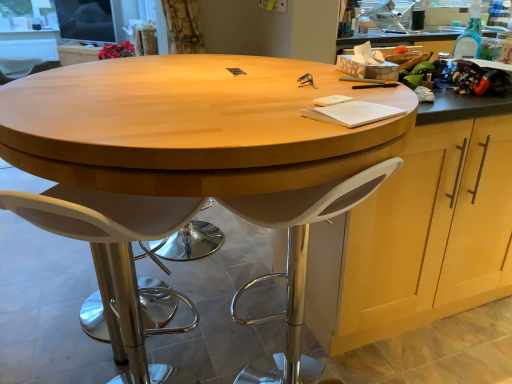
The width and height of the screenshot is (512, 384). Identify the location of light wood cabinet at upper center, which appears as the first cabinetry when viewed from the back. (76, 53).

Locate an element on the screen. Image resolution: width=512 pixels, height=384 pixels. white plastic stool at center is located at coordinates (297, 260).

Locate an element on the screen. white plastic stool at lower left, the second chair in the left-to-right sequence is located at coordinates (114, 258).

Is curtaintextured fabric at upper left placed right next to white plastic stool at center?

No, curtaintextured fabric at upper left is not next to white plastic stool at center.

Considering the relative positions of curtaintextured fabric at upper left and white plastic stool at center in the image provided, is curtaintextured fabric at upper left to the left of white plastic stool at center from the viewer's perspective?

Yes.

Looking at this image, is curtaintextured fabric at upper left smaller than white plastic stool at center?

Yes.

From a real-world perspective, between curtaintextured fabric at upper left and white plastic stool at center, who is vertically lower?

In real-world perspective, white plastic stool at center is lower.

Considering the relative sizes of white plastic stool at center and white plastic stool at lower left, the first chair when ordered from bottom to top, in the image provided, is white plastic stool at center taller than white plastic stool at lower left, the first chair when ordered from bottom to top,?

Correct, white plastic stool at center is much taller as white plastic stool at lower left, the first chair when ordered from bottom to top.

Where is `stool above the white plastic stool at lower left, which is counted as the 2th chair, starting from the back (from a real-world perspective)`? The width and height of the screenshot is (512, 384). stool above the white plastic stool at lower left, which is counted as the 2th chair, starting from the back (from a real-world perspective) is located at coordinates (297, 260).

Is the surface of white plastic stool at center in direct contact with white plastic stool at lower left, which is counted as the 2th chair, starting from the back?

No, white plastic stool at center is not making contact with white plastic stool at lower left, which is counted as the 2th chair, starting from the back.

Is white plastic stool at center at the right side of white plastic stool at lower left, the first chair when ordered from bottom to top?

Indeed, white plastic stool at center is positioned on the right side of white plastic stool at lower left, the first chair when ordered from bottom to top.

Which is correct: white plastic stool at lower left, acting as the 2th chair starting from the top, is inside wooden cabinet at right, which is the first cabinetry from right to left, or outside of it?

white plastic stool at lower left, acting as the 2th chair starting from the top, lies outside wooden cabinet at right, which is the first cabinetry from right to left.

From a real-world perspective, between white plastic stool at lower left, which is the 1th chair in front-to-back order, and wooden cabinet at right, which is the 1th cabinetry from bottom to top, who is vertically lower?

white plastic stool at lower left, which is the 1th chair in front-to-back order.

Is white plastic stool at lower left, which is the 1th chair in front-to-back order, looking in the opposite direction of wooden cabinet at right, which is the second cabinetry from top to bottom?

That's not correct — white plastic stool at lower left, which is the 1th chair in front-to-back order, is not looking away from wooden cabinet at right, which is the second cabinetry from top to bottom.

Looking at the image, does white plastic stool at lower left, which is the 1th chair in front-to-back order, seem bigger or smaller compared to wooden cabinet at right, arranged as the 1th cabinetry when viewed from the front?

white plastic stool at lower left, which is the 1th chair in front-to-back order, is smaller than wooden cabinet at right, arranged as the 1th cabinetry when viewed from the front.

Based on the photo, which is in front, light wood cabinet at upper center, the second cabinetry from the bottom, or transparent glass bottle at upper right?

transparent glass bottle at upper right is more forward.

Is light wood cabinet at upper center, arranged as the 1th cabinetry when viewed from the top, looking in the opposite direction of transparent glass bottle at upper right?

No, light wood cabinet at upper center, arranged as the 1th cabinetry when viewed from the top, is not facing the opposite direction of transparent glass bottle at upper right.

Is light wood cabinet at upper center, marked as the 2th cabinetry in a right-to-left arrangement, taller or shorter than transparent glass bottle at upper right?

Considering their sizes, light wood cabinet at upper center, marked as the 2th cabinetry in a right-to-left arrangement, has more height than transparent glass bottle at upper right.

Consider the image. Does white plastic stool at lower left, placed as the 1th chair when sorted from right to left, turn towards transparent glass bottle at upper right?

No, white plastic stool at lower left, placed as the 1th chair when sorted from right to left, is not facing towards transparent glass bottle at upper right.

At what (x,y) coordinates should I click in order to perform the action: click on bottle on the right side of white plastic stool at lower left, which is the 1th chair in front-to-back order. Please return your answer as a coordinate pair (x, y). Looking at the image, I should click on (470, 35).

From a real-world perspective, is white plastic stool at lower left, the second chair in the left-to-right sequence, over transparent glass bottle at upper right?

Actually, white plastic stool at lower left, the second chair in the left-to-right sequence, is physically below transparent glass bottle at upper right in the real world.

Is white plastic stool at lower left, which is the 1th chair in front-to-back order, not near transparent glass bottle at upper right?

That's right, there is a large distance between white plastic stool at lower left, which is the 1th chair in front-to-back order, and transparent glass bottle at upper right.

From the image's perspective, is light wood cabinet at upper center, placed as the 1th cabinetry when sorted from left to right, above or below curtaintextured fabric at upper left?

From the image's perspective, light wood cabinet at upper center, placed as the 1th cabinetry when sorted from left to right, appears above curtaintextured fabric at upper left.

Is light wood cabinet at upper center, marked as the 2th cabinetry in a right-to-left arrangement, further to the viewer compared to curtaintextured fabric at upper left?

That is True.

Is curtaintextured fabric at upper left located within light wood cabinet at upper center, which appears as the first cabinetry when viewed from the back?

Definitely not — curtaintextured fabric at upper left is not inside light wood cabinet at upper center, which appears as the first cabinetry when viewed from the back.

Does wooden cabinet at right, which is the first cabinetry from right to left, have a smaller size compared to light wood cabinet at upper center, the second cabinetry from the bottom?

Actually, wooden cabinet at right, which is the first cabinetry from right to left, might be larger than light wood cabinet at upper center, the second cabinetry from the bottom.

Can you see wooden cabinet at right, which is the first cabinetry from right to left, touching light wood cabinet at upper center, placed as the 1th cabinetry when sorted from left to right?

No, wooden cabinet at right, which is the first cabinetry from right to left, is not touching light wood cabinet at upper center, placed as the 1th cabinetry when sorted from left to right.

Which is correct: wooden cabinet at right, which is the 2th cabinetry from left to right, is inside light wood cabinet at upper center, placed as the 1th cabinetry when sorted from left to right, or outside of it?

wooden cabinet at right, which is the 2th cabinetry from left to right, is spatially situated outside light wood cabinet at upper center, placed as the 1th cabinetry when sorted from left to right.

In the image, there is a wooden cabinet at right, which is the 1th cabinetry from bottom to top. Identify the location of cabinetry above it (from the image's perspective). The height and width of the screenshot is (384, 512). (76, 53).

Find the location of a particular element. The image size is (512, 384). curtain above the white plastic stool at center (from the image's perspective) is located at coordinates (183, 26).

You are a GUI agent. You are given a task and a screenshot of the screen. Output one action in this format:
    pyautogui.click(x=<x>, y=<y>)
    Task: Click on the chair that is in front of the white plastic stool at center
    The image size is (512, 384).
    Given the screenshot: What is the action you would take?
    pyautogui.click(x=114, y=258)

Based on their spatial positions, is white plastic chair at left, positioned as the 1th chair in back-to-front order, or light wood cabinet at upper center, placed as the 1th cabinetry when sorted from left to right, closer to white plastic stool at center?

The object closer to white plastic stool at center is white plastic chair at left, positioned as the 1th chair in back-to-front order.

When comparing their distances from curtaintextured fabric at upper left, does white plastic stool at lower left, which is counted as the 2th chair, starting from the back, or light wood cabinet at upper center, arranged as the 1th cabinetry when viewed from the top, seem closer?

white plastic stool at lower left, which is counted as the 2th chair, starting from the back, is closer to curtaintextured fabric at upper left.

Looking at the image, which one is located closer to transparent glass bottle at upper right, white plastic chair at left, marked as the 1th chair in a left-to-right arrangement, or wooden cabinet at right, which is the first cabinetry from right to left?

wooden cabinet at right, which is the first cabinetry from right to left, is positioned closer to the anchor transparent glass bottle at upper right.

From the image, which object appears to be nearer to white plastic stool at lower left, the first chair when ordered from bottom to top, transparent glass bottle at upper right or white plastic chair at left, positioned as the 1th chair in back-to-front order?

Based on the image, transparent glass bottle at upper right appears to be nearer to white plastic stool at lower left, the first chair when ordered from bottom to top.

Looking at the image, which one is located further to white plastic stool at lower left, placed as the 1th chair when sorted from right to left, transparent glass bottle at upper right or wooden cabinet at right, which is the second cabinetry from top to bottom?

Among the two, transparent glass bottle at upper right is located further to white plastic stool at lower left, placed as the 1th chair when sorted from right to left.

Considering their positions, is curtaintextured fabric at upper left positioned closer to transparent glass bottle at upper right than wooden cabinet at right, which is the first cabinetry from right to left?

Among the two, curtaintextured fabric at upper left is located nearer to transparent glass bottle at upper right.

Looking at the image, which one is located further to white plastic chair at left, which is the 1th chair in top-to-bottom order, transparent glass bottle at upper right or wooden cabinet at right, which is the second cabinetry from top to bottom?

transparent glass bottle at upper right lies further to white plastic chair at left, which is the 1th chair in top-to-bottom order, than the other object.

From the image, which object appears to be nearer to white plastic chair at left, positioned as the 1th chair in back-to-front order, wooden cabinet at right, arranged as the 1th cabinetry when viewed from the front, or transparent glass bottle at upper right?

wooden cabinet at right, arranged as the 1th cabinetry when viewed from the front, lies closer to white plastic chair at left, positioned as the 1th chair in back-to-front order, than the other object.

Identify the location of curtain located between transparent glass bottle at upper right and light wood cabinet at upper center, placed as the 1th cabinetry when sorted from left to right, in the depth direction. This screenshot has height=384, width=512. (183, 26).

Identify the location of curtain positioned between white plastic stool at lower left, acting as the 2th chair starting from the top, and light wood cabinet at upper center, arranged as the 1th cabinetry when viewed from the top, from near to far. This screenshot has width=512, height=384. (183, 26).

The height and width of the screenshot is (384, 512). I want to click on bottle between white plastic stool at lower left, acting as the 2th chair starting from the top, and light wood cabinet at upper center, which appears as the first cabinetry when viewed from the back, from front to back, so click(x=470, y=35).

Locate an element on the screen. The image size is (512, 384). chair between white plastic stool at center and light wood cabinet at upper center, marked as the 2th cabinetry in a right-to-left arrangement, in the front-back direction is located at coordinates (20, 68).